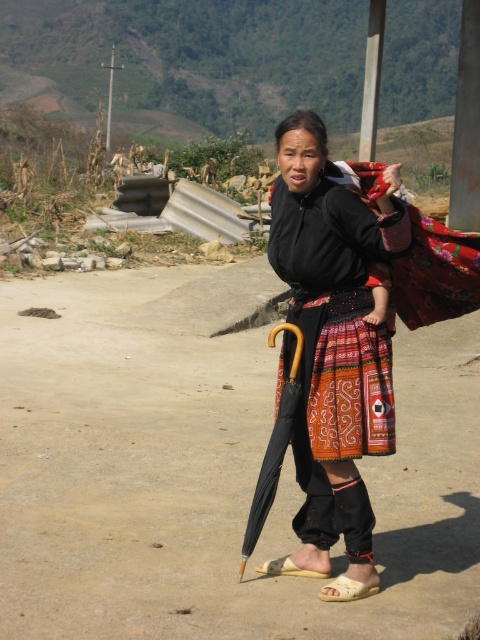
In the scene shown: You are a photographer trying to capture the woman in the scene. You want to focus on her footwear. Which sandal is positioned closer to the camera between the beige fabric sandal at lower center and the light brown leather sandal at lower center?

The beige fabric sandal at lower center is closer to the viewer than the light brown leather sandal at lower center, so it will appear closer to the camera.